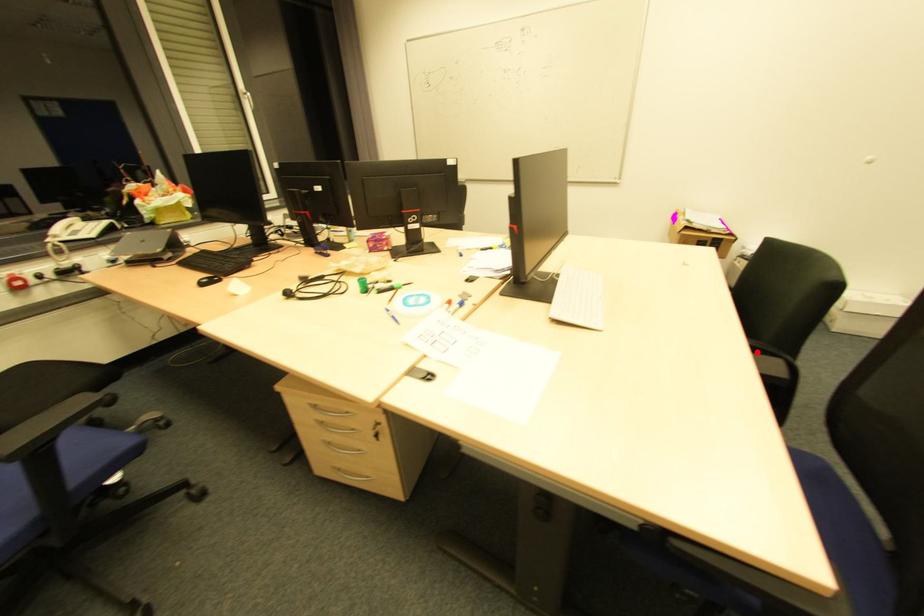
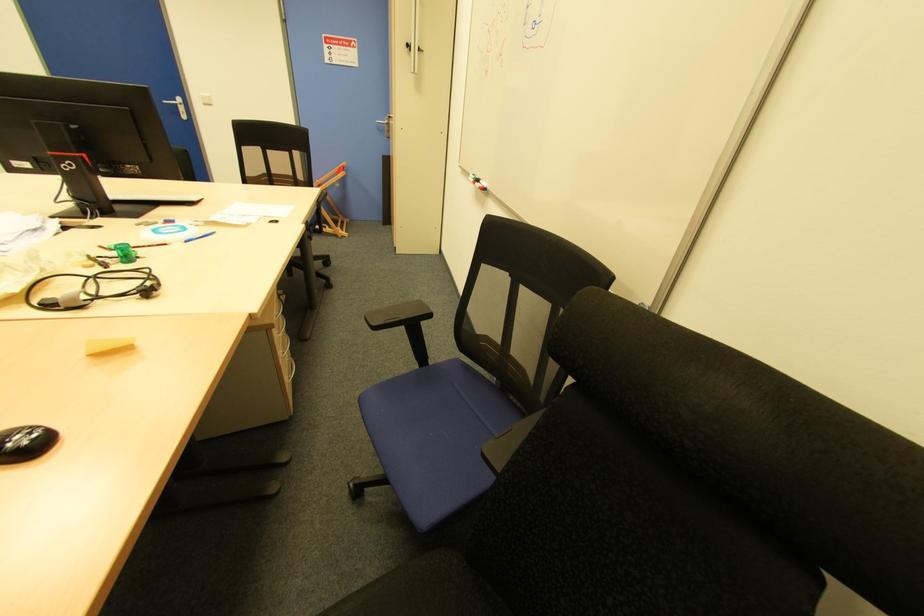
Question: I am providing you with two images of the same scene from different viewpoints. A red point is marked on the first image. Can you still see the location of the red point in image 2?

Choices:
 (A) Yes
 (B) No

Answer: (B)